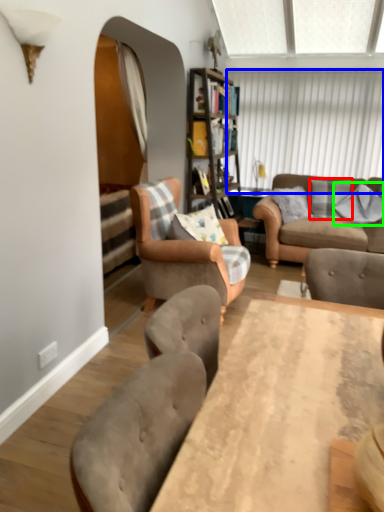
Question: Considering the real-world distances, which object is farthest from pillow (highlighted by a red box)? window screen (highlighted by a blue box) or pillow (highlighted by a green box)?

Choices:
 (A) window screen
 (B) pillow

Answer: (A)